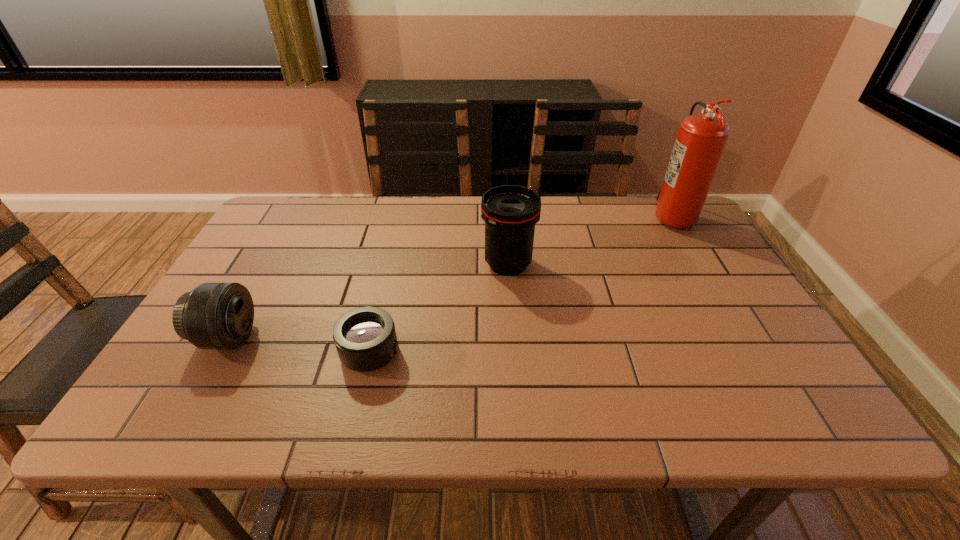
The width and height of the screenshot is (960, 540). What are the coordinates of `vacant region at the far left corner` in the screenshot? It's located at (263, 229).

Identify the location of free spot between the farthest telephoto lens and the second tallest telephoto lens. (368, 301).

I want to click on free space between the third nearest object and the third tallest object, so click(368, 301).

The height and width of the screenshot is (540, 960). What are the coordinates of `free area in between the leftmost telephoto lens and the tallest object` in the screenshot? It's located at (449, 276).

This screenshot has width=960, height=540. In order to click on empty location between the second object from left to right and the rightmost object in this screenshot , I will do [520, 284].

You are a GUI agent. You are given a task and a screenshot of the screen. Output one action in this format:
    pyautogui.click(x=<x>, y=<y>)
    Task: Click on the free spot between the shortest object and the second farthest object
    
    Given the screenshot: What is the action you would take?
    pyautogui.click(x=440, y=309)

This screenshot has height=540, width=960. I want to click on free area in between the leftmost telephoto lens and the rightmost object, so click(x=449, y=276).

Image resolution: width=960 pixels, height=540 pixels. I want to click on vacant region between the third nearest object and the shortest object, so click(x=440, y=309).

The image size is (960, 540). Identify the location of vacant space that is in between the shortest telephoto lens and the rightmost object. (520, 284).

The image size is (960, 540). What are the coordinates of `unoccupied area between the rightmost object and the second telephoto lens from left to right` in the screenshot? It's located at (520, 284).